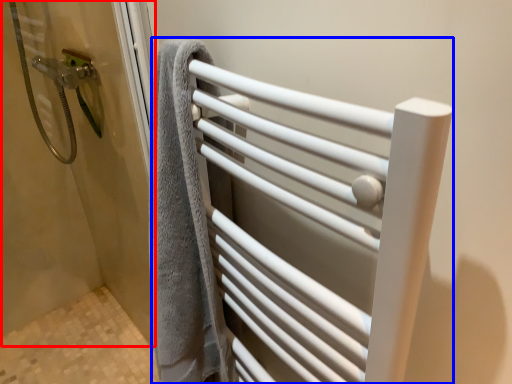
Question: Which point is closer to the camera, screen door (highlighted by a red box) or towel rack (highlighted by a blue box)?

Choices:
 (A) screen door
 (B) towel rack

Answer: (B)